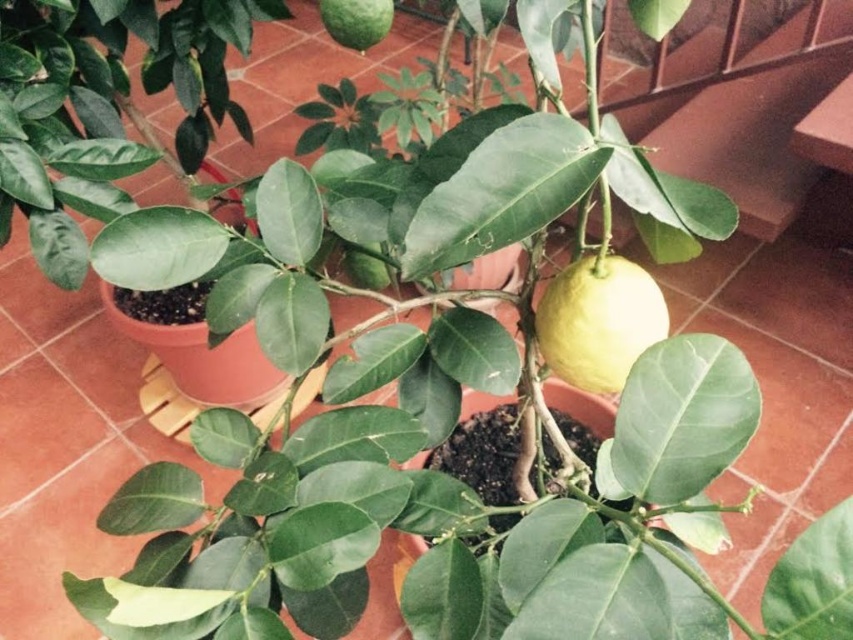
Question: Can you confirm if yellow matte lemon at center is bigger than green matte lime at upper center?

Choices:
 (A) yes
 (B) no

Answer: (A)

Question: Which object appears farthest from the camera in this image?

Choices:
 (A) green matte lime at upper center
 (B) yellow matte lemon at center

Answer: (A)

Question: Among these objects, which one is nearest to the camera?

Choices:
 (A) green matte lime at upper center
 (B) yellow matte lemon at center

Answer: (B)

Question: Is the position of yellow matte lemon at center less distant than that of green matte lime at upper center?

Choices:
 (A) yes
 (B) no

Answer: (A)

Question: Which object appears farthest from the camera in this image?

Choices:
 (A) green matte lime at upper center
 (B) yellow matte lemon at center

Answer: (A)

Question: Is yellow matte lemon at center to the left of green matte lime at upper center from the viewer's perspective?

Choices:
 (A) no
 (B) yes

Answer: (A)